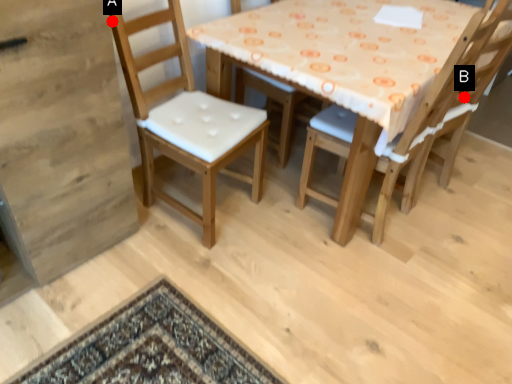
Question: Two points are circled on the image, labeled by A and B beside each circle. Which point is closer to the camera taking this photo?

Choices:
 (A) A is closer
 (B) B is closer

Answer: (A)